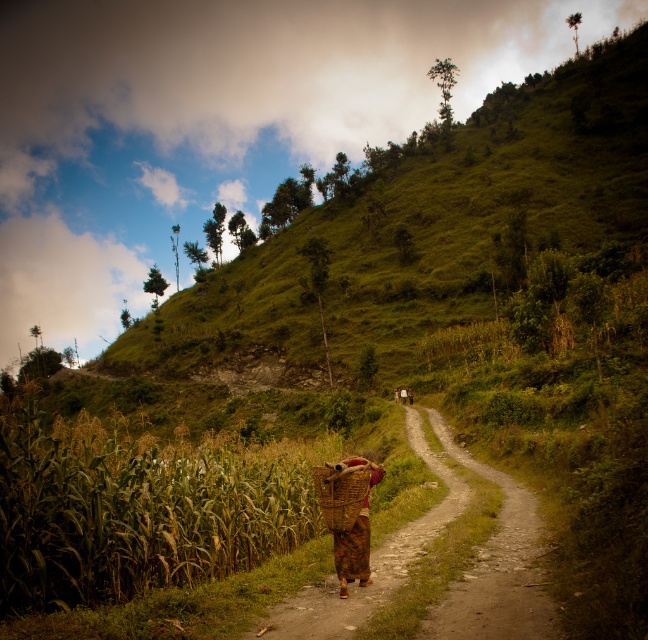
Question: Does green leafy corn at lower left have a smaller size compared to brown woven basket at center?

Choices:
 (A) yes
 (B) no

Answer: (B)

Question: Which object is farther from the camera taking this photo?

Choices:
 (A) green leafy corn at lower left
 (B) brown woven basket at center

Answer: (A)

Question: Does green leafy corn at lower left have a lesser width compared to brown woven basket at center?

Choices:
 (A) no
 (B) yes

Answer: (A)

Question: Which object is farther from the camera taking this photo?

Choices:
 (A) brown dirt path at center
 (B) brown woven basket at center
 (C) green leafy corn at lower left

Answer: (C)

Question: Observing the image, what is the correct spatial positioning of brown dirt path at center in reference to brown woven basket at center?

Choices:
 (A) above
 (B) below

Answer: (B)

Question: Which point is closer to the camera taking this photo?

Choices:
 (A) (43, 604)
 (B) (472, 573)

Answer: (A)